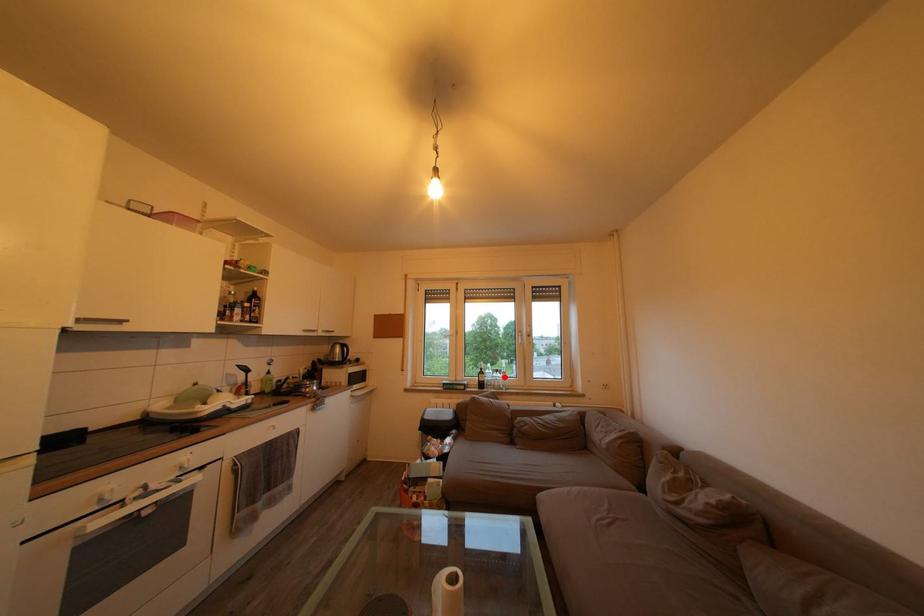
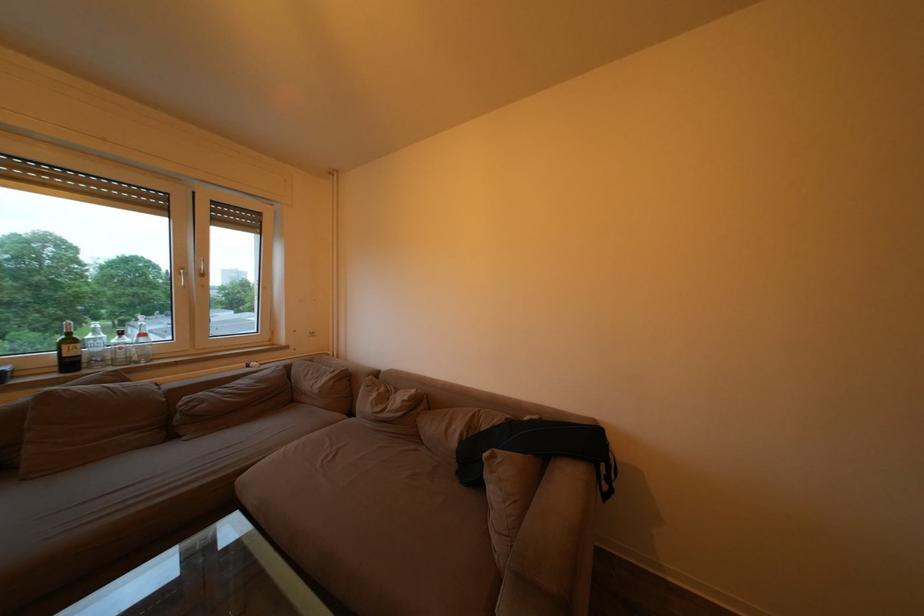
Question: I am providing you with two images of the same scene from different viewpoints. In image1, a red point is highlighted. Considering the same 3D point in image2, which of the following is correct?

Choices:
 (A) It is closer
 (B) It is farther

Answer: (A)